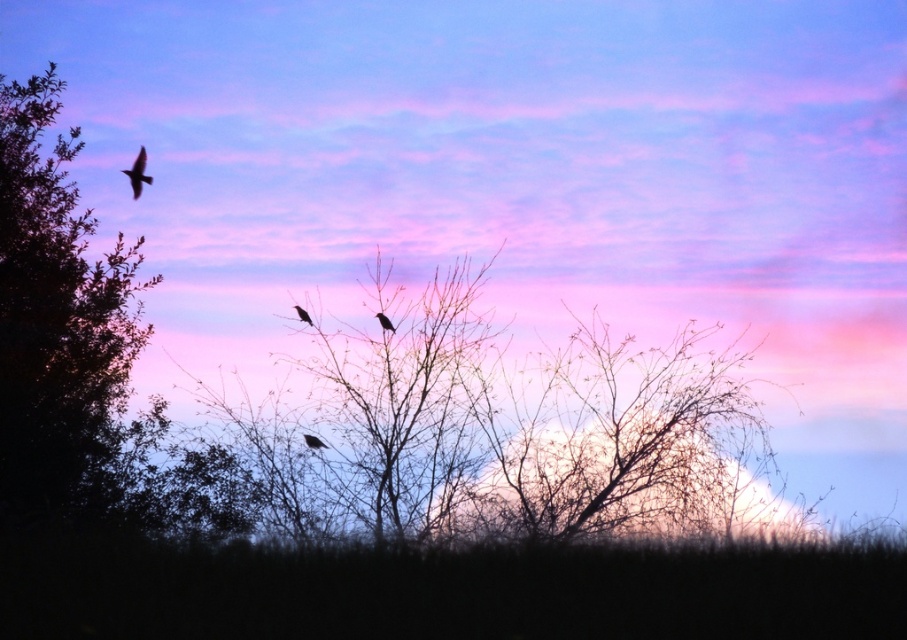
Question: Does dark green leafy tree at left come in front of matte black bird at center?

Choices:
 (A) no
 (B) yes

Answer: (B)

Question: Among these objects, which one is nearest to the camera?

Choices:
 (A) black matte bird at upper left
 (B) black matte bird at center
 (C) dark green leafy tree at left
 (D) white fluffy cloud at center

Answer: (D)

Question: Is silhouette feathered bird at center smaller than matte black bird at center?

Choices:
 (A) yes
 (B) no

Answer: (B)

Question: Which point is closer to the camera taking this photo?

Choices:
 (A) (295, 305)
 (B) (502, 481)
 (C) (3, 326)
 (D) (140, 172)

Answer: (C)

Question: Does black matte bird at upper left lie in front of silhouette feathered bird at center?

Choices:
 (A) yes
 (B) no

Answer: (B)

Question: Among these points, which one is farthest from the camera?

Choices:
 (A) (139, 340)
 (B) (387, 324)
 (C) (626, 476)
 (D) (137, 163)

Answer: (D)